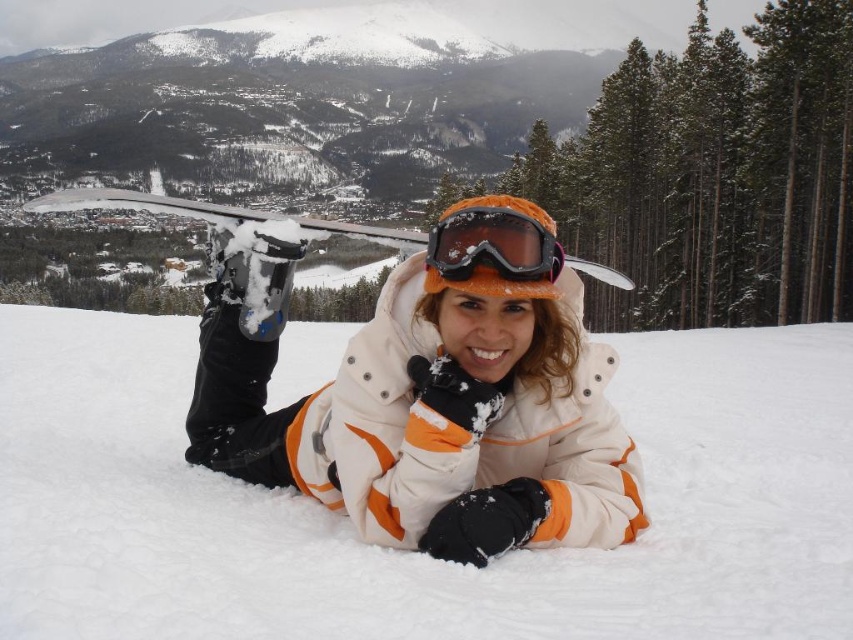
Question: Which point is farther from the camera taking this photo?

Choices:
 (A) (500, 216)
 (B) (700, 541)

Answer: (A)

Question: Does white snow at center have a greater width compared to orange matte/glossy goggles at center?

Choices:
 (A) yes
 (B) no

Answer: (A)

Question: Does white snow at center appear over orange matte/glossy goggles at center?

Choices:
 (A) yes
 (B) no

Answer: (B)

Question: Which point is farther to the camera?

Choices:
 (A) white snow at center
 (B) orange matte/glossy goggles at center

Answer: (B)

Question: Does white snow at center appear under orange matte/glossy goggles at center?

Choices:
 (A) yes
 (B) no

Answer: (A)